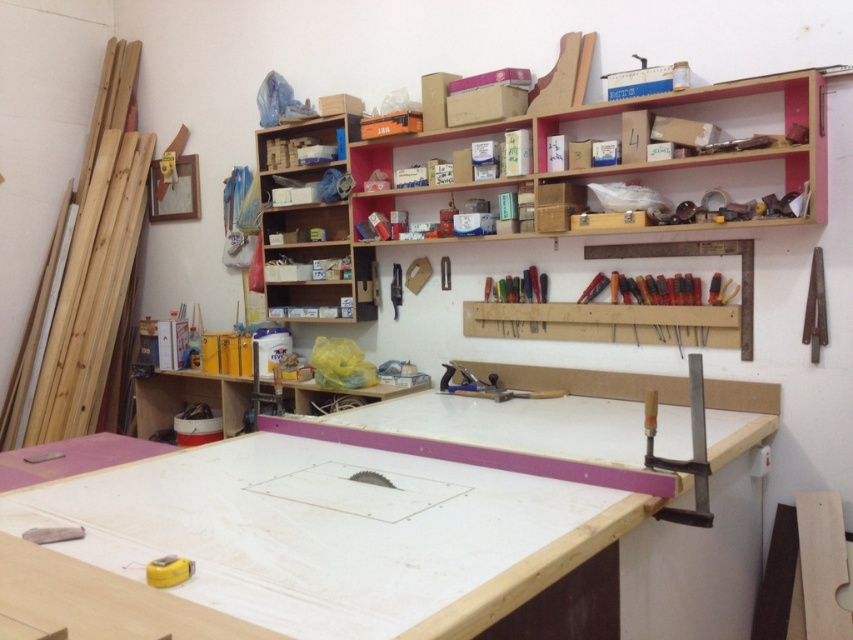
You are a carpenter standing at the entrance of the workshop, and you need to reach the metallic silver clamp at right. Can you estimate whether it is within your arm reach?

The metallic silver clamp at right is 5.11 feet away from the camera, which is beyond the typical arm reach of a person, so it is not within reach.

You are a carpenter working in the workshop. You need to know which object is shorter between the metallic silver clamp at right and the wooden ruler at right. Can you tell me?

The metallic silver clamp at right is not as tall as the wooden ruler at right, so the metallic silver clamp at right is shorter.